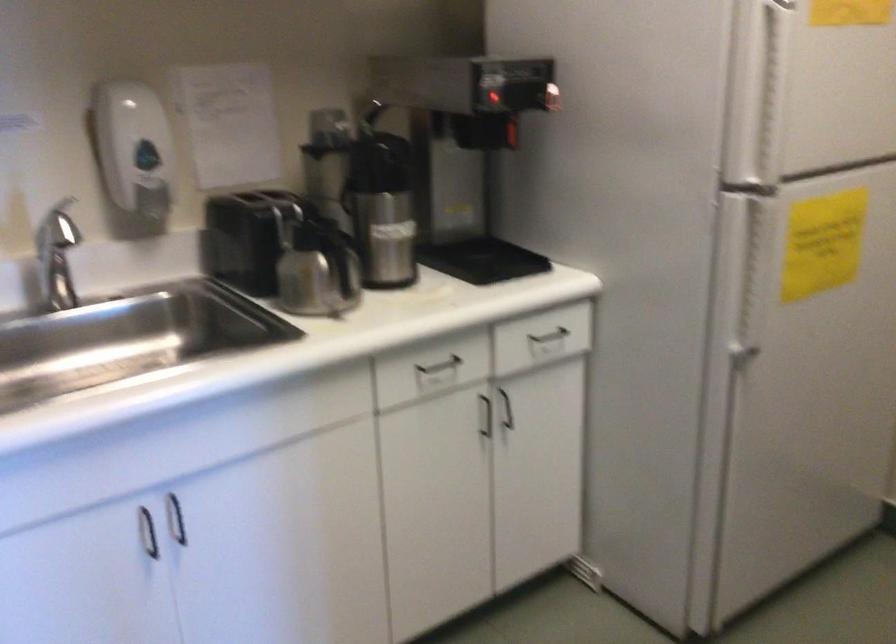
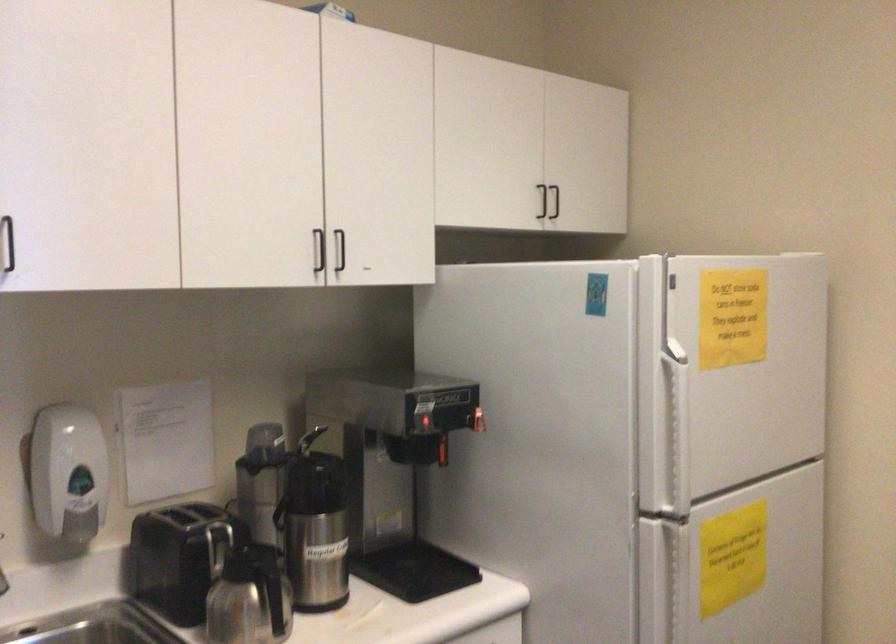
Locate, in the second image, the point that corresponds to (x=317, y=263) in the first image.

(251, 599)